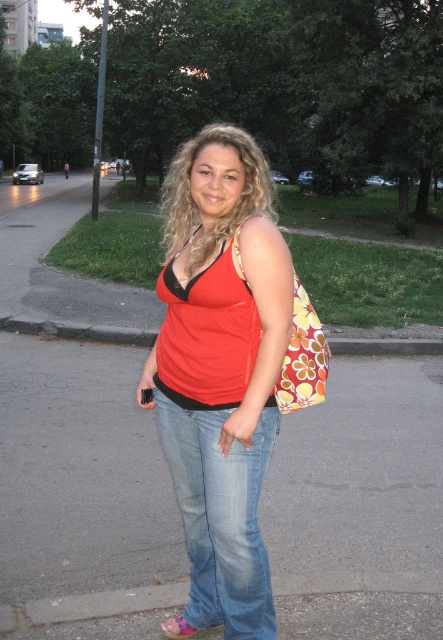
Question: Which point appears closest to the camera in this image?

Choices:
 (A) (187, 348)
 (B) (228, 202)

Answer: (B)

Question: Which of the following is the farthest from the observer?

Choices:
 (A) matte red vest at center
 (B) brushed concrete curb at lower center

Answer: (B)

Question: Does matte red tank top at center lie in front of pink fabric sandal at lower center?

Choices:
 (A) no
 (B) yes

Answer: (B)

Question: Among these objects, which one is farthest from the camera?

Choices:
 (A) brushed concrete curb at lower center
 (B) pink fabric sandal at lower center
 (C) gray asphalt pavement at center

Answer: (A)

Question: Does gray asphalt pavement at center have a smaller size compared to light blue denim jeans at center?

Choices:
 (A) no
 (B) yes

Answer: (A)

Question: Does matte red tank top at center have a larger size compared to floral fabric bag at right?

Choices:
 (A) yes
 (B) no

Answer: (A)